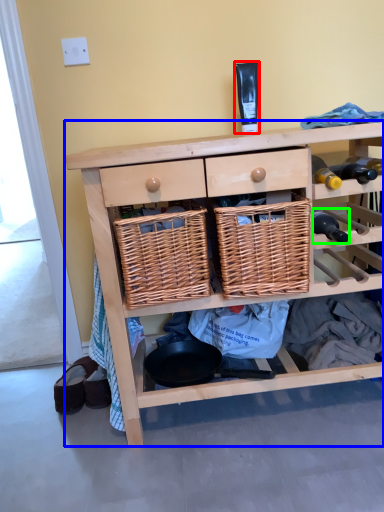
Question: Which object is the farthest from toiletry (highlighted by a red box)? Choose among these: shelf (highlighted by a blue box) or bottle (highlighted by a green box).

Choices:
 (A) shelf
 (B) bottle

Answer: (A)